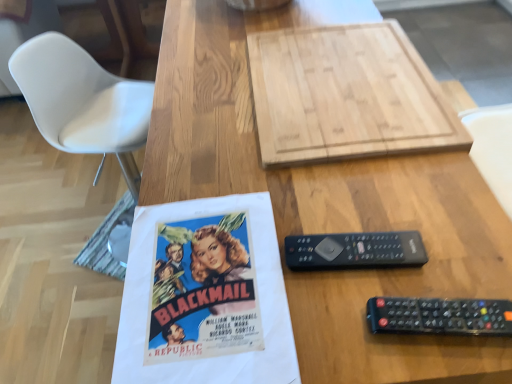
Question: Is black plastic remote at right inside or outside of natural wood cutting board at upper center?

Choices:
 (A) outside
 (B) inside

Answer: (A)

Question: Looking at their shapes, would you say black plastic remote at right is wider or thinner than natural wood cutting board at upper center?

Choices:
 (A) wide
 (B) thin

Answer: (B)

Question: Which of these objects is positioned closest to the black plastic remote at right?

Choices:
 (A) natural wood cutting board at upper center
 (B) black plastic remote at lower right

Answer: (B)

Question: Which object is the closest to the black plastic remote at right?

Choices:
 (A) black plastic remote at lower right
 (B) natural wood cutting board at upper center

Answer: (A)